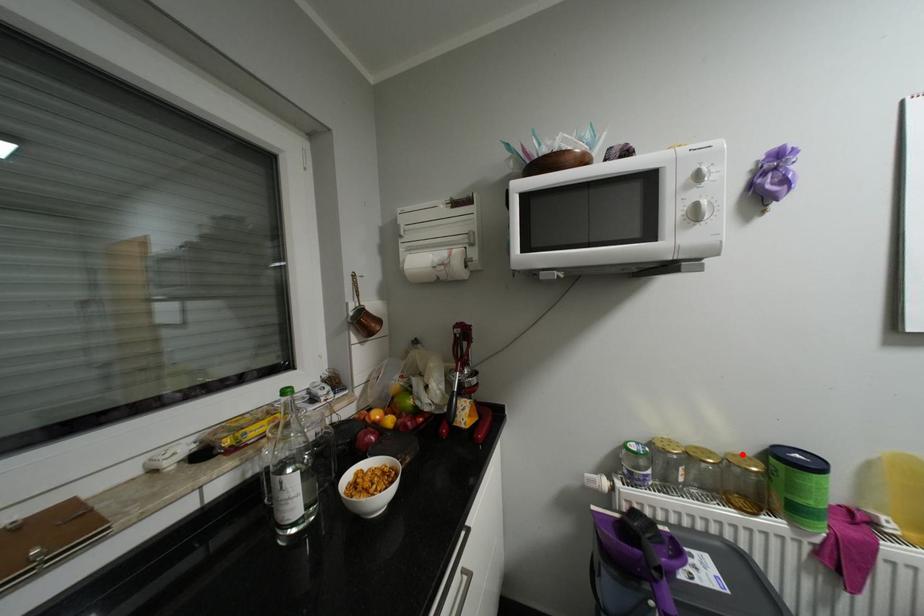
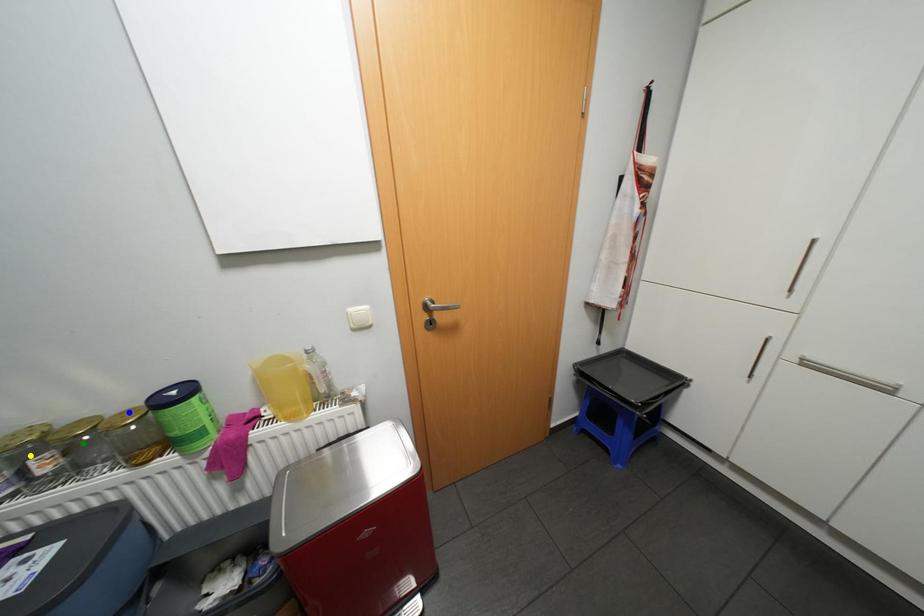
Question: I am providing you with two images of the same scene from different viewpoints. A red point is marked on the first image. You are given multiple points on the second image. Which spot in image 2 lines up with the point in image 1?

Choices:
 (A) blue point
 (B) green point
 (C) yellow point

Answer: (A)